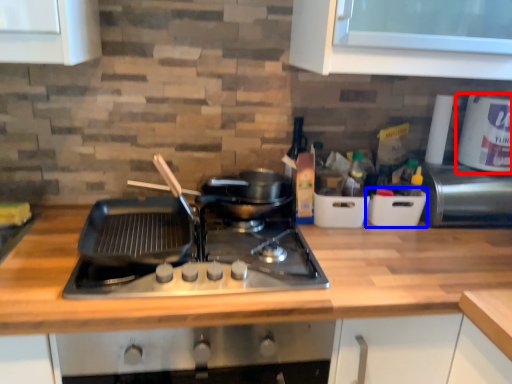
Question: Which of the following is the farthest to the observer, kitchen appliance (highlighted by a red box) or appliance (highlighted by a blue box)?

Choices:
 (A) kitchen appliance
 (B) appliance

Answer: (B)